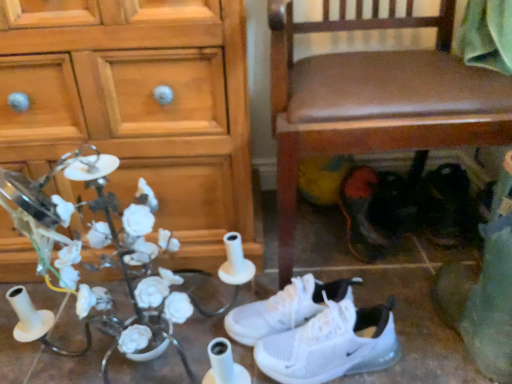
Question: Considering the relative sizes of black leather shoes at lower right, which is the fourth footwear in left-to-right order, and wooden cabinet at left in the image provided, is black leather shoes at lower right, which is the fourth footwear in left-to-right order, smaller than wooden cabinet at left?

Choices:
 (A) no
 (B) yes

Answer: (B)

Question: Can you see black leather shoes at lower right, which is the fourth footwear in left-to-right order, touching wooden cabinet at left?

Choices:
 (A) no
 (B) yes

Answer: (A)

Question: Considering the relative positions of black leather shoes at lower right, placed as the first footwear when sorted from right to left, and wooden cabinet at left in the image provided, is black leather shoes at lower right, placed as the first footwear when sorted from right to left, to the left of wooden cabinet at left from the viewer's perspective?

Choices:
 (A) yes
 (B) no

Answer: (B)

Question: From the image's perspective, would you say black leather shoes at lower right, placed as the first footwear when sorted from right to left, is positioned over wooden cabinet at left?

Choices:
 (A) yes
 (B) no

Answer: (B)

Question: From a real-world perspective, is black leather shoes at lower right, placed as the first footwear when sorted from right to left, physically below wooden cabinet at left?

Choices:
 (A) no
 (B) yes

Answer: (B)

Question: Relative to white mesh sneakers at lower center, the second footwear viewed from the left, is white mesh sneakers at center, which is the 4th footwear in right-to-left order, in front or behind?

Choices:
 (A) front
 (B) behind

Answer: (B)

Question: In terms of height, does white mesh sneakers at center, which is the 4th footwear in right-to-left order, look taller or shorter compared to white mesh sneakers at lower center, the second footwear viewed from the left?

Choices:
 (A) short
 (B) tall

Answer: (A)

Question: Considering the positions of point (229, 317) and point (352, 347), is point (229, 317) closer or farther from the camera than point (352, 347)?

Choices:
 (A) farther
 (B) closer

Answer: (A)

Question: From a real-world perspective, is white mesh sneakers at center, which is the 4th footwear in right-to-left order, positioned above or below white mesh sneakers at lower center, the second footwear viewed from the left?

Choices:
 (A) above
 (B) below

Answer: (B)

Question: Does point (89, 137) appear closer or farther from the camera than point (304, 327)?

Choices:
 (A) closer
 (B) farther

Answer: (B)

Question: From a real-world perspective, is wooden cabinet at left positioned above or below white mesh sneakers at lower center, which is the third footwear in right-to-left order?

Choices:
 (A) above
 (B) below

Answer: (A)

Question: Is wooden cabinet at left spatially inside white mesh sneakers at lower center, the second footwear viewed from the left, or outside of it?

Choices:
 (A) outside
 (B) inside

Answer: (A)

Question: In the image, is wooden cabinet at left positioned in front of or behind white mesh sneakers at lower center, the second footwear viewed from the left?

Choices:
 (A) front
 (B) behind

Answer: (B)

Question: Considering the positions of white ceramic flowers at left and wooden cabinet at left in the image, is white ceramic flowers at left wider or thinner than wooden cabinet at left?

Choices:
 (A) thin
 (B) wide

Answer: (B)

Question: Is point (52, 173) positioned closer to the camera than point (106, 72)?

Choices:
 (A) farther
 (B) closer

Answer: (A)